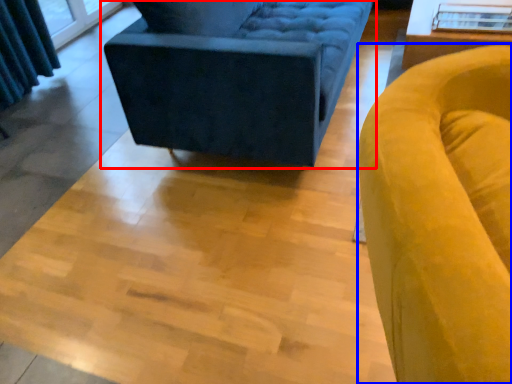
Question: Which point is closer to the camera, studio couch (highlighted by a red box) or chair (highlighted by a blue box)?

Choices:
 (A) studio couch
 (B) chair

Answer: (B)